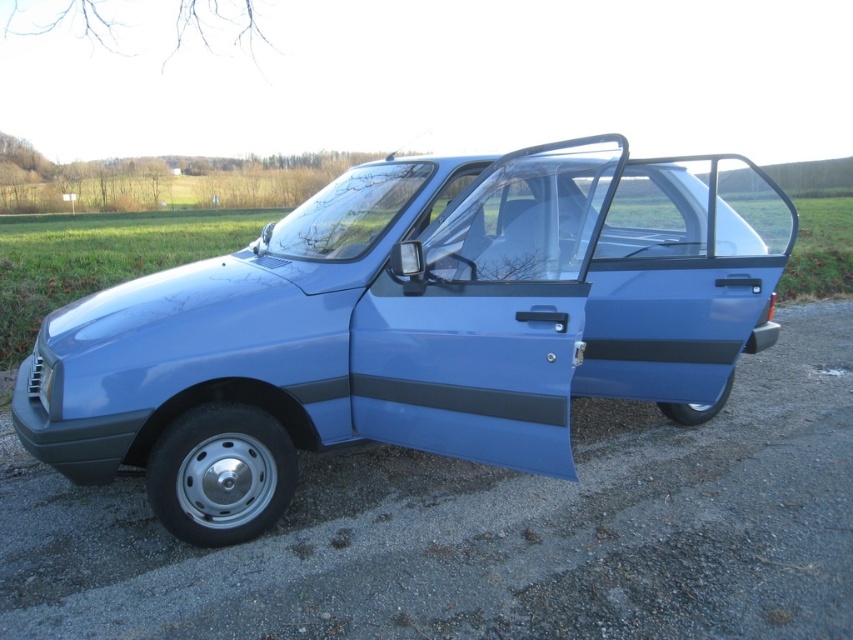
Question: Is matte blue car at center wider than black matte stripe at door right?

Choices:
 (A) no
 (B) yes

Answer: (A)

Question: Among these objects, which one is nearest to the camera?

Choices:
 (A) matte blue car at center
 (B) black matte stripe at door right

Answer: (A)

Question: Is matte blue car at center smaller than black matte stripe at door right?

Choices:
 (A) yes
 (B) no

Answer: (A)

Question: Is matte blue car at center behind black matte stripe at door right?

Choices:
 (A) no
 (B) yes

Answer: (A)